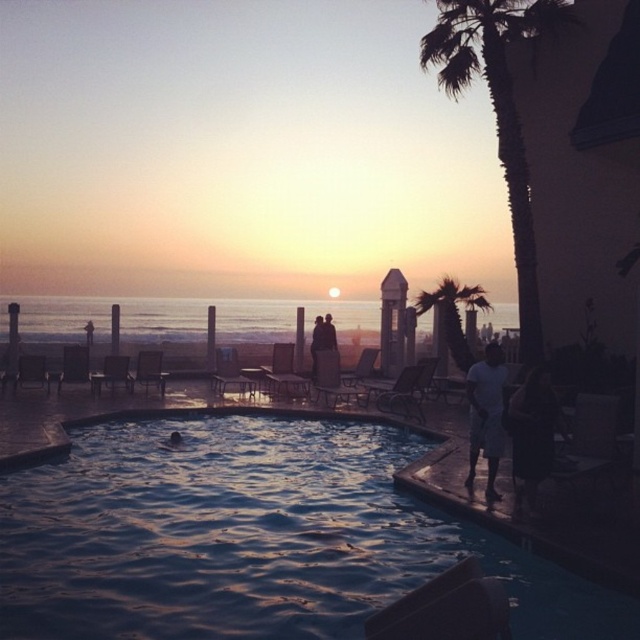
Is shiny blue water at center behind green leafy palm tree at upper right?

No.

Who is positioned more to the right, shiny blue water at center or green leafy palm tree at upper right?

green leafy palm tree at upper right

This screenshot has height=640, width=640. What do you see at coordinates (250, 538) in the screenshot?
I see `shiny blue water at center` at bounding box center [250, 538].

Locate an element on the screen. Image resolution: width=640 pixels, height=640 pixels. shiny blue water at center is located at coordinates (250, 538).

Who is shorter, dark fabric bag at lower right or white cotton shorts at lower right?

dark fabric bag at lower right is shorter.

Does dark fabric bag at lower right have a greater width compared to white cotton shorts at lower right?

Yes.

Where is `dark fabric bag at lower right`? This screenshot has width=640, height=640. dark fabric bag at lower right is located at coordinates (532, 432).

Identify the location of dark fabric bag at lower right. (532, 432).

Is point (451, 284) more distant than point (314, 360)?

That is True.

Who is higher up, green leafy palm tree at upper right or smooth dark hair at center?

green leafy palm tree at upper right

Which is behind, point (449, 305) or point (328, 344)?

The point (328, 344) is behind.

This screenshot has width=640, height=640. I want to click on green leafy palm tree at upper right, so click(x=452, y=314).